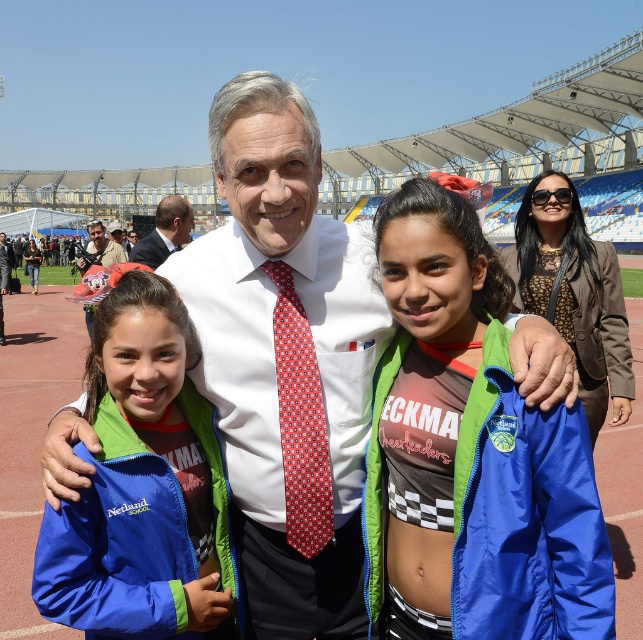
Who is shorter, white smooth shirt at center or matte red tie at center?

matte red tie at center

Who is more forward, (x=314, y=150) or (x=93, y=259)?

Point (x=314, y=150)

Where is `white smooth shirt at center`? Image resolution: width=643 pixels, height=640 pixels. white smooth shirt at center is located at coordinates (285, 362).

Looking at this image, between white smooth shirt at center and blue nylon jacket at center, which one has less height?

blue nylon jacket at center is shorter.

Where is `white smooth shirt at center`? The width and height of the screenshot is (643, 640). white smooth shirt at center is located at coordinates (285, 362).

Does point (372, 275) come closer to viewer compared to point (203, 417)?

No, (372, 275) is behind (203, 417).

Can you confirm if white smooth shirt at center is positioned below blue fabric jacket at left?

Indeed, white smooth shirt at center is positioned under blue fabric jacket at left.

The height and width of the screenshot is (640, 643). What do you see at coordinates (285, 362) in the screenshot?
I see `white smooth shirt at center` at bounding box center [285, 362].

Identify the location of white smooth shirt at center. This screenshot has height=640, width=643. (285, 362).